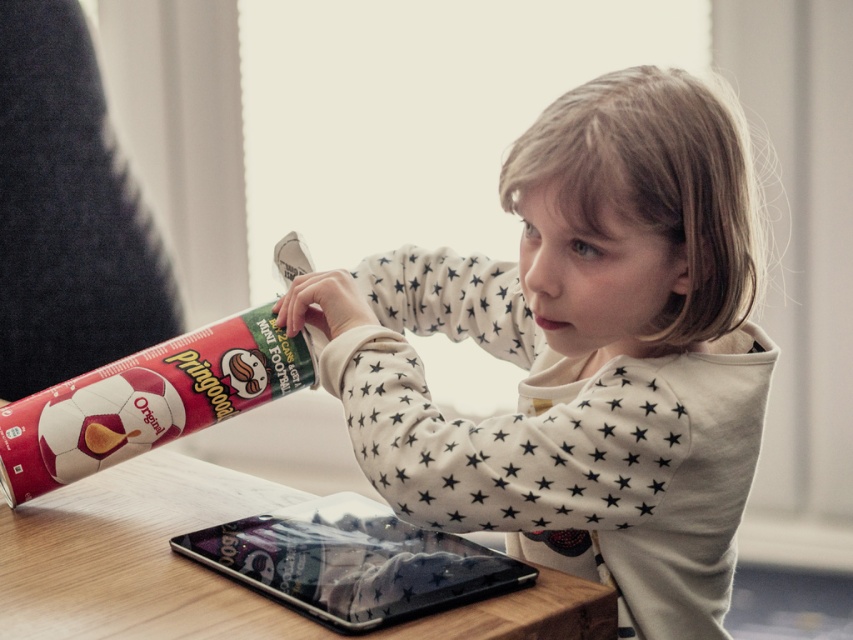
Question: Based on their relative distances, which object is nearer to the transparent plastic tablet at center?

Choices:
 (A) white star-patterned sweater at center
 (B) wooden table at center

Answer: (B)

Question: Estimate the real-world distances between objects in this image. Which object is farther from the transparent plastic tablet at center?

Choices:
 (A) white star-patterned sweater at center
 (B) wooden table at center

Answer: (A)

Question: Does white star-patterned sweater at center appear under transparent plastic tablet at center?

Choices:
 (A) yes
 (B) no

Answer: (B)

Question: Is white star-patterned sweater at center smaller than transparent plastic tablet at center?

Choices:
 (A) no
 (B) yes

Answer: (A)

Question: Is wooden table at center smaller than transparent plastic tablet at center?

Choices:
 (A) no
 (B) yes

Answer: (A)

Question: Which object is farther from the camera taking this photo?

Choices:
 (A) transparent plastic tablet at center
 (B) wooden table at center

Answer: (A)